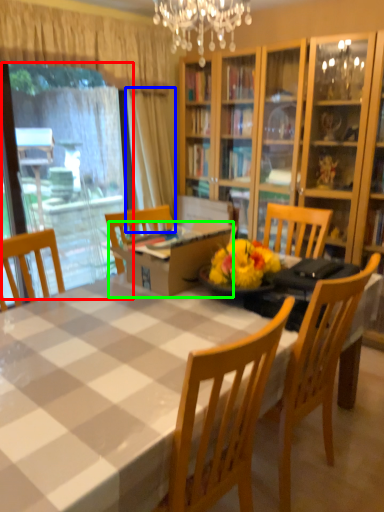
Question: Which object is the farthest from window screen (highlighted by a red box)? Choose among these: curtain (highlighted by a blue box) or cardboard box (highlighted by a green box).

Choices:
 (A) curtain
 (B) cardboard box

Answer: (B)